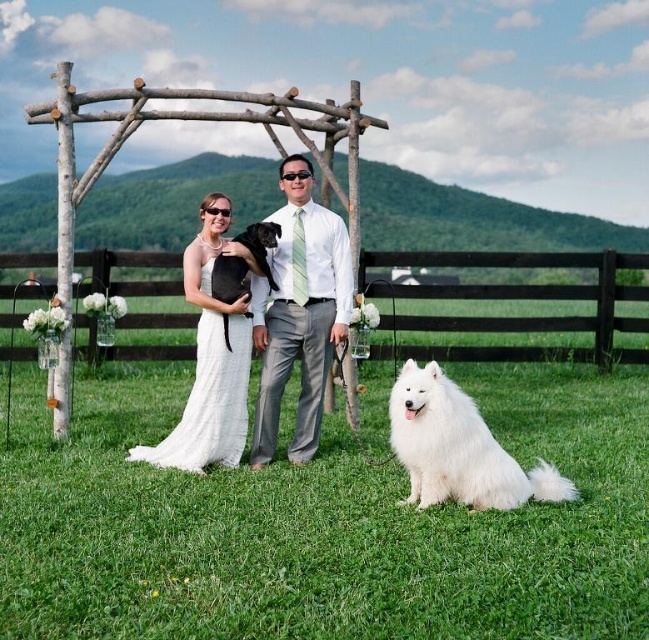
Question: Which object is the closest to the white satin dress at center?

Choices:
 (A) light gray fabric suit at center
 (B) black wooden fence at lower center

Answer: (A)

Question: Which point is closer to the camera?

Choices:
 (A) white satin dress at center
 (B) light gray fabric suit at center
 (C) white fluffy dog at lower right

Answer: (C)

Question: Is black wooden fence at lower center positioned at the back of white satin dress at center?

Choices:
 (A) no
 (B) yes

Answer: (B)

Question: Which of the following is the farthest from the observer?

Choices:
 (A) (184, 275)
 (B) (393, 259)
 (C) (227, 269)

Answer: (B)

Question: Does black wooden fence at lower center appear on the right side of light gray fabric suit at center?

Choices:
 (A) no
 (B) yes

Answer: (B)

Question: Does light gray fabric suit at center have a lesser width compared to black fur dog at center?

Choices:
 (A) no
 (B) yes

Answer: (A)